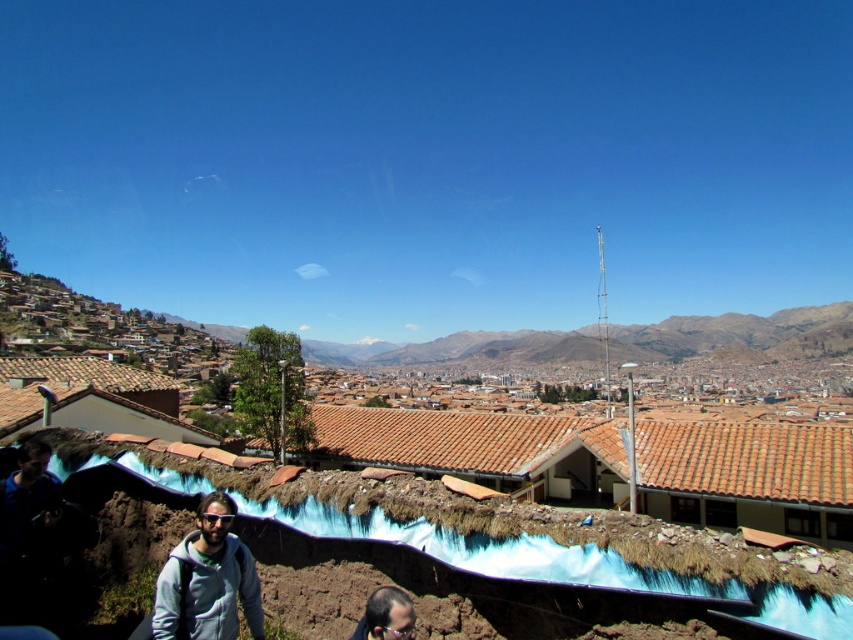
Which of these two, gray fleece jacket at lower center or smooth brown hair at lower center, stands taller?

With more height is gray fleece jacket at lower center.

Is gray fleece jacket at lower center positioned behind smooth brown hair at lower center?

Yes, gray fleece jacket at lower center is further from the viewer.

Locate an element on the screen. Image resolution: width=853 pixels, height=640 pixels. gray fleece jacket at lower center is located at coordinates (207, 580).

Locate an element on the screen. The width and height of the screenshot is (853, 640). gray fleece jacket at lower center is located at coordinates (207, 580).